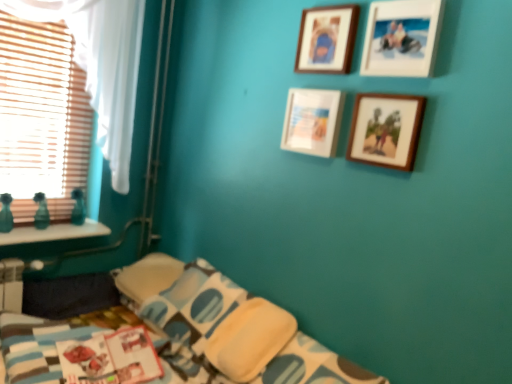
Describe the element at coordinates (402, 38) in the screenshot. This screenshot has width=512, height=384. I see `wooden photo frame at upper right, which is counted as the third picture frame, starting from the bottom` at that location.

Find the location of a particular element. The image size is (512, 384). yellow soft pillow at lower right is located at coordinates (249, 339).

Locate an element on the screen. Image resolution: width=512 pixels, height=384 pixels. wooden photo frame at upper right, the 1th picture frame positioned from the bottom is located at coordinates (386, 130).

What do you see at coordinates (386, 130) in the screenshot? I see `wooden photo frame at upper right, the 1th picture frame positioned from the bottom` at bounding box center [386, 130].

You are a GUI agent. You are given a task and a screenshot of the screen. Output one action in this format:
    pyautogui.click(x=<x>, y=<y>)
    Task: Click on the wooden picture frame at upper center, which is counted as the fourth picture frame, starting from the bottom
    
    Given the screenshot: What is the action you would take?
    pyautogui.click(x=327, y=39)

I want to click on white matte picture frame at center, which is counted as the 3th picture frame, starting from the top, so coord(312,121).

Looking at this image, does green glass vases at left appear on the left side of wooden photo frame at upper right, the second picture frame viewed from the top?

Yes, green glass vases at left is to the left of wooden photo frame at upper right, the second picture frame viewed from the top.

Between point (90, 227) and point (420, 53), which one is positioned in front?

Point (420, 53)

Can you confirm if green glass vases at left is bigger than wooden photo frame at upper right, the second picture frame viewed from the top?

Correct, green glass vases at left is larger in size than wooden photo frame at upper right, the second picture frame viewed from the top.

Is green glass vases at left not close to wooden photo frame at upper right, which is counted as the third picture frame, starting from the bottom?

Yes, green glass vases at left is far from wooden photo frame at upper right, which is counted as the third picture frame, starting from the bottom.

Between wooden picture frame at upper center, which is the first picture frame from top to bottom, and wooden photo frame at upper right, which is counted as the third picture frame, starting from the bottom, which one appears on the right side from the viewer's perspective?

From the viewer's perspective, wooden photo frame at upper right, which is counted as the third picture frame, starting from the bottom, appears more on the right side.

From a real-world perspective, is wooden picture frame at upper center, which is counted as the fourth picture frame, starting from the bottom, located higher than wooden photo frame at upper right, the second picture frame viewed from the top?

No, from a real-world perspective, wooden picture frame at upper center, which is counted as the fourth picture frame, starting from the bottom, is not on top of wooden photo frame at upper right, the second picture frame viewed from the top.

Can you tell me how much wooden picture frame at upper center, which is counted as the fourth picture frame, starting from the bottom, and wooden photo frame at upper right, which is counted as the third picture frame, starting from the bottom, differ in facing direction?

wooden picture frame at upper center, which is counted as the fourth picture frame, starting from the bottom, and wooden photo frame at upper right, which is counted as the third picture frame, starting from the bottom, are facing 0.495 degrees away from each other.

Which object is thinner, wooden picture frame at upper center, which is the first picture frame from top to bottom, or wooden photo frame at upper right, the second picture frame viewed from the top?

Thinner between the two is wooden picture frame at upper center, which is the first picture frame from top to bottom.

Is yellow soft pillow at lower right smaller than green glass vases at left?

No, yellow soft pillow at lower right is not smaller than green glass vases at left.

Is yellow soft pillow at lower right positioned behind green glass vases at left?

No, yellow soft pillow at lower right is closer to the camera.

Find the location of a particular element. window sill that is on the left side of yellow soft pillow at lower right is located at coordinates (54, 233).

Can you confirm if yellow soft pillow at lower right is shorter than green glass vases at left?

No.

Is white sheer curtain at left positioned behind white matte picture frame at center, which appears as the second picture frame when ordered from the bottom?

Yes.

Does white sheer curtain at left touch white matte picture frame at center, which appears as the second picture frame when ordered from the bottom?

No.

Which of these two, white sheer curtain at left or white matte picture frame at center, which is counted as the 3th picture frame, starting from the top, is bigger?

With larger size is white sheer curtain at left.

From the image's perspective, which is below, white sheer curtain at left or green glass vases at left?

green glass vases at left, from the image's perspective.

Looking at this image, is white sheer curtain at left facing towards green glass vases at left?

Yes, white sheer curtain at left is turned towards green glass vases at left.

In terms of width, does white sheer curtain at left look wider or thinner when compared to green glass vases at left?

Clearly, white sheer curtain at left has less width compared to green glass vases at left.

Is white sheer curtain at left not close to green glass vases at left?

No, white sheer curtain at left is not far away from green glass vases at left.

Which is further, [393,111] or [305,15]?

Positioned behind is point [305,15].

Where is `the 1st picture frame positioned below the wooden picture frame at upper center, which is counted as the fourth picture frame, starting from the bottom (from a real-world perspective)`? Image resolution: width=512 pixels, height=384 pixels. the 1st picture frame positioned below the wooden picture frame at upper center, which is counted as the fourth picture frame, starting from the bottom (from a real-world perspective) is located at coordinates (386, 130).

Can you tell me how much wooden photo frame at upper right, the 1th picture frame positioned from the bottom, and wooden picture frame at upper center, which is the first picture frame from top to bottom, differ in facing direction?

The angle between the facing direction of wooden photo frame at upper right, the 1th picture frame positioned from the bottom, and the facing direction of wooden picture frame at upper center, which is the first picture frame from top to bottom, is 0.654 degrees.

Considering the sizes of objects wooden photo frame at upper right, which ranks as the 4th picture frame in top-to-bottom order, and wooden picture frame at upper center, which is counted as the fourth picture frame, starting from the bottom, in the image provided, who is shorter, wooden photo frame at upper right, which ranks as the 4th picture frame in top-to-bottom order, or wooden picture frame at upper center, which is counted as the fourth picture frame, starting from the bottom,?

With less height is wooden photo frame at upper right, which ranks as the 4th picture frame in top-to-bottom order.

How different are the orientations of wooden photo frame at upper right, the second picture frame viewed from the top, and yellow soft pillow at lower right in degrees?

They differ by 0.913 degrees in their facing directions.

Based on the photo, which is more to the left, wooden photo frame at upper right, the second picture frame viewed from the top, or yellow soft pillow at lower right?

yellow soft pillow at lower right is more to the left.

Considering their positions, is wooden photo frame at upper right, which is counted as the third picture frame, starting from the bottom, located in front of or behind yellow soft pillow at lower right?

Clearly, wooden photo frame at upper right, which is counted as the third picture frame, starting from the bottom, is in front of yellow soft pillow at lower right.

From a real-world perspective, relative to yellow soft pillow at lower right, is wooden photo frame at upper right, the second picture frame viewed from the top, vertically above or below?

wooden photo frame at upper right, the second picture frame viewed from the top, is situated higher than yellow soft pillow at lower right in the real world.

Find the location of a particular element. The width and height of the screenshot is (512, 384). the 3rd picture frame positioned above the green glass vases at left (from the image's perspective) is located at coordinates (402, 38).

Identify the location of the 2nd picture frame to the left of the wooden photo frame at upper right, the second picture frame viewed from the top, starting your count from the anchor. (327, 39).

Considering their positions, is white matte picture frame at center, which is counted as the 3th picture frame, starting from the top, positioned closer to yellow soft pillow at lower right than wooden picture frame at upper center, which is the first picture frame from top to bottom?

white matte picture frame at center, which is counted as the 3th picture frame, starting from the top, is positioned closer to the anchor yellow soft pillow at lower right.

When comparing their distances from wooden picture frame at upper center, which is counted as the fourth picture frame, starting from the bottom, does yellow soft pillow at lower right or green glass vases at left seem closer?

Based on the image, yellow soft pillow at lower right appears to be nearer to wooden picture frame at upper center, which is counted as the fourth picture frame, starting from the bottom.

Estimate the real-world distances between objects in this image. Which object is closer to white matte picture frame at center, which is counted as the 3th picture frame, starting from the top, wooden photo frame at upper right, which ranks as the 4th picture frame in top-to-bottom order, or wooden photo frame at upper right, the second picture frame viewed from the top?

wooden photo frame at upper right, which ranks as the 4th picture frame in top-to-bottom order, is closer to white matte picture frame at center, which is counted as the 3th picture frame, starting from the top.

Which object lies nearer to the anchor point white matte picture frame at center, which appears as the second picture frame when ordered from the bottom, wooden photo frame at upper right, which is counted as the third picture frame, starting from the bottom, or green glass vases at left?

Among the two, wooden photo frame at upper right, which is counted as the third picture frame, starting from the bottom, is located nearer to white matte picture frame at center, which appears as the second picture frame when ordered from the bottom.

Considering their positions, is green glass vases at left positioned further to wooden picture frame at upper center, which is the first picture frame from top to bottom, than white matte picture frame at center, which is counted as the 3th picture frame, starting from the top?

Based on the image, green glass vases at left appears to be further to wooden picture frame at upper center, which is the first picture frame from top to bottom.

From the image, which object appears to be farther from wooden photo frame at upper right, which is counted as the third picture frame, starting from the bottom, white matte picture frame at center, which appears as the second picture frame when ordered from the bottom, or wooden photo frame at upper right, the 1th picture frame positioned from the bottom?

white matte picture frame at center, which appears as the second picture frame when ordered from the bottom, is further to wooden photo frame at upper right, which is counted as the third picture frame, starting from the bottom.

Based on their spatial positions, is green glass vases at left or white matte picture frame at center, which is counted as the 3th picture frame, starting from the top, closer to wooden photo frame at upper right, the 1th picture frame positioned from the bottom?

white matte picture frame at center, which is counted as the 3th picture frame, starting from the top, is closer to wooden photo frame at upper right, the 1th picture frame positioned from the bottom.

Looking at the image, which one is located further to green glass vases at left, white sheer curtain at left or white matte picture frame at center, which appears as the second picture frame when ordered from the bottom?

The object further to green glass vases at left is white matte picture frame at center, which appears as the second picture frame when ordered from the bottom.

Identify the location of pillow located between green glass vases at left and wooden photo frame at upper right, which ranks as the 4th picture frame in top-to-bottom order, in the left-right direction. (249, 339).

Identify the location of pillow between white sheer curtain at left and wooden photo frame at upper right, which is counted as the third picture frame, starting from the bottom, in the horizontal direction. The height and width of the screenshot is (384, 512). (249, 339).

Identify the location of pillow between white sheer curtain at left and wooden photo frame at upper right, the 1th picture frame positioned from the bottom. (249, 339).

Locate an element on the screen. This screenshot has width=512, height=384. picture frame between wooden picture frame at upper center, which is the first picture frame from top to bottom, and white matte picture frame at center, which appears as the second picture frame when ordered from the bottom, from top to bottom is located at coordinates (402, 38).